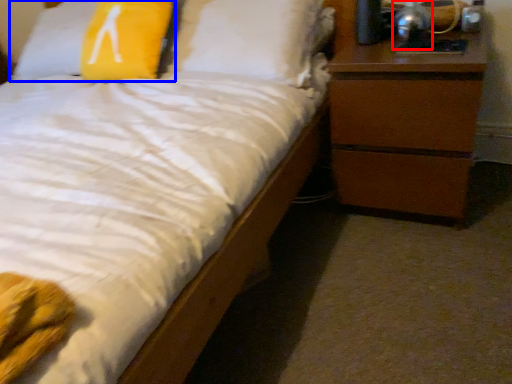
Question: Among these objects, which one is nearest to the camera, bedside lamp (highlighted by a red box) or pillow (highlighted by a blue box)?

Choices:
 (A) bedside lamp
 (B) pillow

Answer: (A)